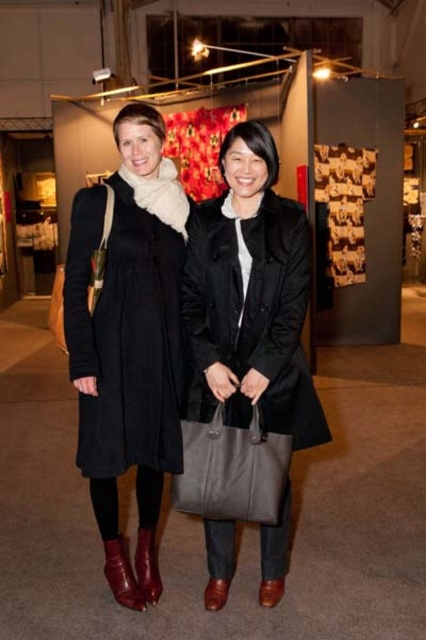
Question: Can you confirm if black matte coat at center is positioned to the left of shiny brown leather boot at lower left?

Choices:
 (A) yes
 (B) no

Answer: (B)

Question: Observing the image, what is the correct spatial positioning of black matte coat at center in reference to leather tote at center?

Choices:
 (A) above
 (B) below

Answer: (A)

Question: Which point appears farthest from the camera in this image?

Choices:
 (A) (166, 317)
 (B) (276, 244)
 (C) (115, 566)

Answer: (C)

Question: Considering the real-world distances, which object is closest to the black woolen dress at left?

Choices:
 (A) shiny brown leather boot at lower left
 (B) leather boot at lower left
 (C) black matte coat at center
 (D) leather tote at center

Answer: (C)

Question: Is black woolen dress at left wider than shiny brown leather boot at lower left?

Choices:
 (A) no
 (B) yes

Answer: (B)

Question: Which object is positioned closest to the leather boot at lower left?

Choices:
 (A) black woolen dress at left
 (B) shiny brown leather boot at lower left
 (C) black matte coat at center
 (D) leather tote at center

Answer: (B)